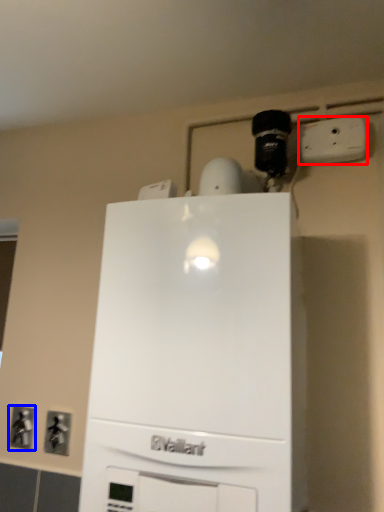
Question: Which of the following is the farthest to the observer, electric outlet (highlighted by a red box) or electric outlet (highlighted by a blue box)?

Choices:
 (A) electric outlet
 (B) electric outlet

Answer: (B)